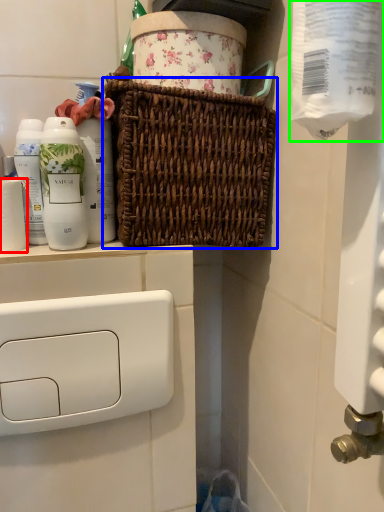
Question: Considering the real-world distances, which object is closest to toilet paper (highlighted by a red box)? picnic basket (highlighted by a blue box) or toilet paper (highlighted by a green box).

Choices:
 (A) picnic basket
 (B) toilet paper

Answer: (A)